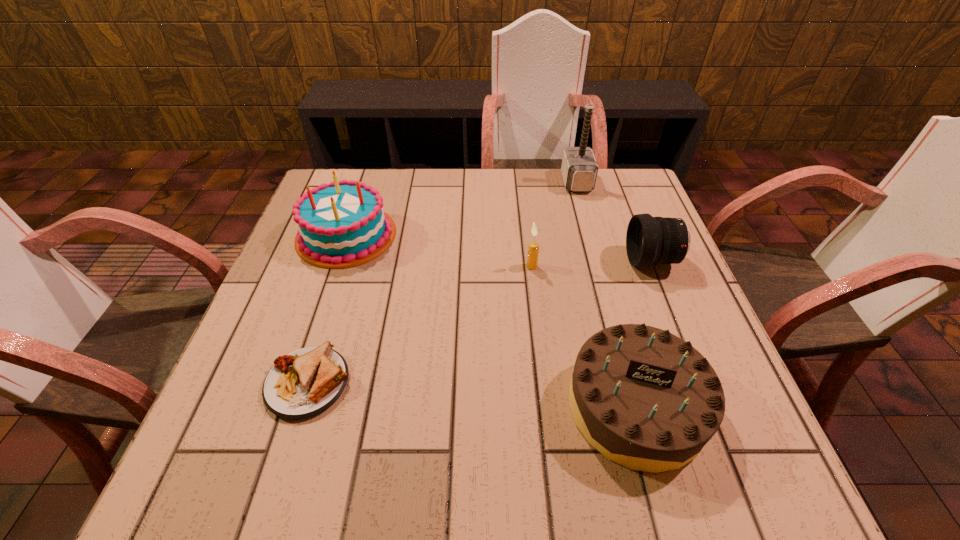
Locate an element on the screen. The image size is (960, 540). blank space located for striking with the head of the farthest object is located at coordinates (504, 182).

This screenshot has height=540, width=960. I want to click on vacant space located for striking with the head of the farthest object, so click(x=518, y=182).

Find the location of a particular element. This screenshot has width=960, height=540. vacant space situated on the back of the second tallest object is located at coordinates (364, 181).

Identify the location of vacant space located on the back of the fourth object from right to left. This screenshot has height=540, width=960. (521, 181).

At what (x,y) coordinates should I click in order to perform the action: click on free space located at the front element of the telephoto lens. Please return your answer as a coordinate pair (x, y). The width and height of the screenshot is (960, 540). Looking at the image, I should click on (531, 261).

This screenshot has height=540, width=960. I want to click on vacant space situated at the front element of the telephoto lens, so point(485,261).

You are a GUI agent. You are given a task and a screenshot of the screen. Output one action in this format:
    pyautogui.click(x=<x>, y=<y>)
    Task: Click on the vacant space located 0.310m at the front element of the telephoto lens
    Image resolution: width=960 pixels, height=540 pixels.
    Given the screenshot: What is the action you would take?
    pyautogui.click(x=497, y=261)

You are a GUI agent. You are given a task and a screenshot of the screen. Output one action in this format:
    pyautogui.click(x=<x>, y=<y>)
    Task: Click on the vacant space located on the left of the shortest object
    
    Given the screenshot: What is the action you would take?
    pyautogui.click(x=233, y=383)

This screenshot has width=960, height=540. I want to click on hammer at the far edge, so coord(579,168).

I want to click on birthday cake present at the far edge, so (x=343, y=224).